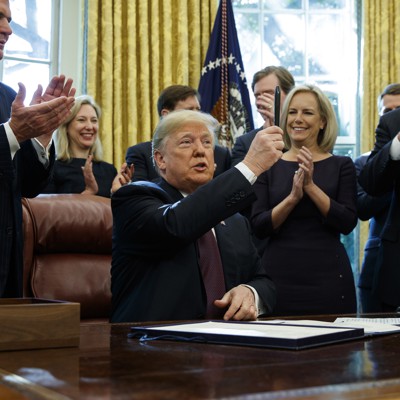
Where is `papers`? papers is located at coordinates (229, 331), (375, 328), (375, 321).